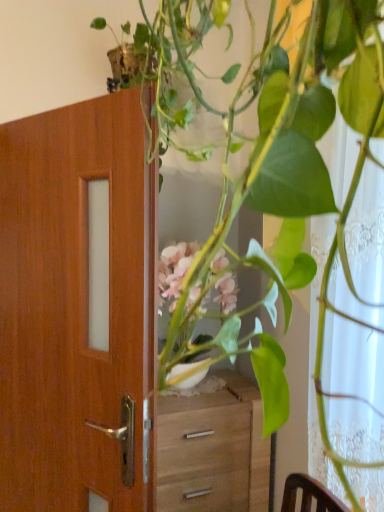
Describe the element at coordinates (77, 309) in the screenshot. I see `wooden door at left` at that location.

Where is `wooden door at left`? This screenshot has height=512, width=384. wooden door at left is located at coordinates (77, 309).

Find the location of a particular element. The width and height of the screenshot is (384, 512). wooden door at left is located at coordinates (77, 309).